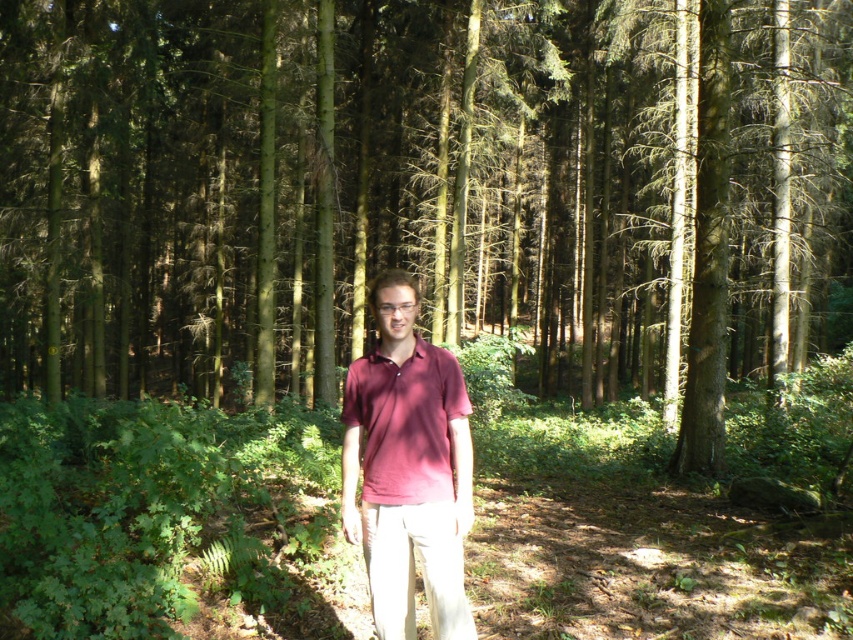
Which is in front, point (194, 56) or point (410, 609)?

Point (410, 609) is in front.

This screenshot has width=853, height=640. What do you see at coordinates (422, 189) in the screenshot? I see `green matte tree at center` at bounding box center [422, 189].

Does point (103, 12) come in front of point (349, 492)?

No, it is behind (349, 492).

Find the location of a particular element. This screenshot has width=853, height=640. green matte tree at center is located at coordinates (422, 189).

The height and width of the screenshot is (640, 853). What do you see at coordinates (422, 189) in the screenshot?
I see `green matte tree at center` at bounding box center [422, 189].

Which of these two, green matte tree at center or matte red shirt at center, stands shorter?

Result: matte red shirt at center

The height and width of the screenshot is (640, 853). Describe the element at coordinates (422, 189) in the screenshot. I see `green matte tree at center` at that location.

Identify the location of green matte tree at center. The image size is (853, 640). (422, 189).

Can you confirm if maroon cotton shirt at center is positioned above matte red shirt at center?

No.

Is point (376, 385) positioned in front of point (393, 433)?

That is False.

Image resolution: width=853 pixels, height=640 pixels. What are the coordinates of `maroon cotton shirt at center` in the screenshot? It's located at [x=408, y=467].